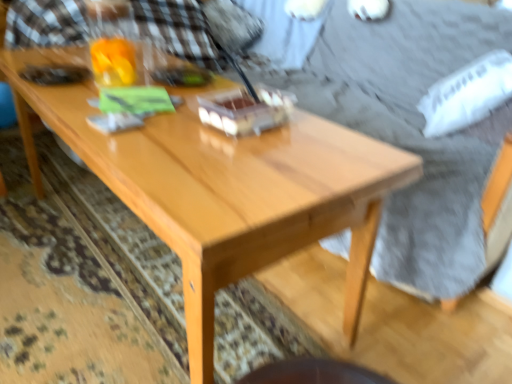
Find the location of `light wood coffee table at center`. light wood coffee table at center is located at coordinates (224, 187).

The height and width of the screenshot is (384, 512). What do you see at coordinates (224, 187) in the screenshot? I see `light wood coffee table at center` at bounding box center [224, 187].

You are a GUI agent. You are given a task and a screenshot of the screen. Output one action in this format:
    pyautogui.click(x=<x>, y=<y>)
    Task: Click on the light wood coffee table at center
    This screenshot has height=384, width=512.
    Given the screenshot: What is the action you would take?
    click(x=224, y=187)